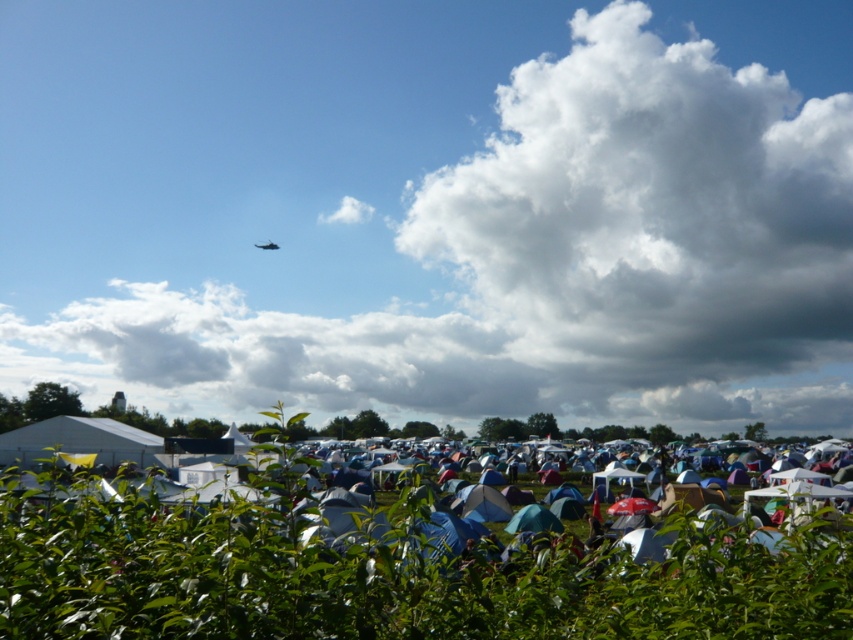
This screenshot has height=640, width=853. What do you see at coordinates (483, 502) in the screenshot? I see `blue fabric tent at center` at bounding box center [483, 502].

Which of these two, blue fabric tent at center or metallic silver airplane at upper center, stands taller?

Standing taller between the two is metallic silver airplane at upper center.

The width and height of the screenshot is (853, 640). I want to click on blue fabric tent at center, so click(483, 502).

Does white fluffy cloud at upper center appear on the left side of metallic silver airplane at upper center?

Incorrect, white fluffy cloud at upper center is not on the left side of metallic silver airplane at upper center.

Is point (396, 248) more distant than point (265, 244)?

Yes.

Is point (822, 20) closer to viewer compared to point (271, 248)?

No.

The height and width of the screenshot is (640, 853). What are the coordinates of `white fluffy cloud at upper center` in the screenshot? It's located at (432, 209).

Does white fluffy cloud at upper center have a greater height compared to blue fabric tent at center?

Yes, white fluffy cloud at upper center is taller than blue fabric tent at center.

The image size is (853, 640). What do you see at coordinates (432, 209) in the screenshot?
I see `white fluffy cloud at upper center` at bounding box center [432, 209].

Locate an element on the screen. white fluffy cloud at upper center is located at coordinates (432, 209).